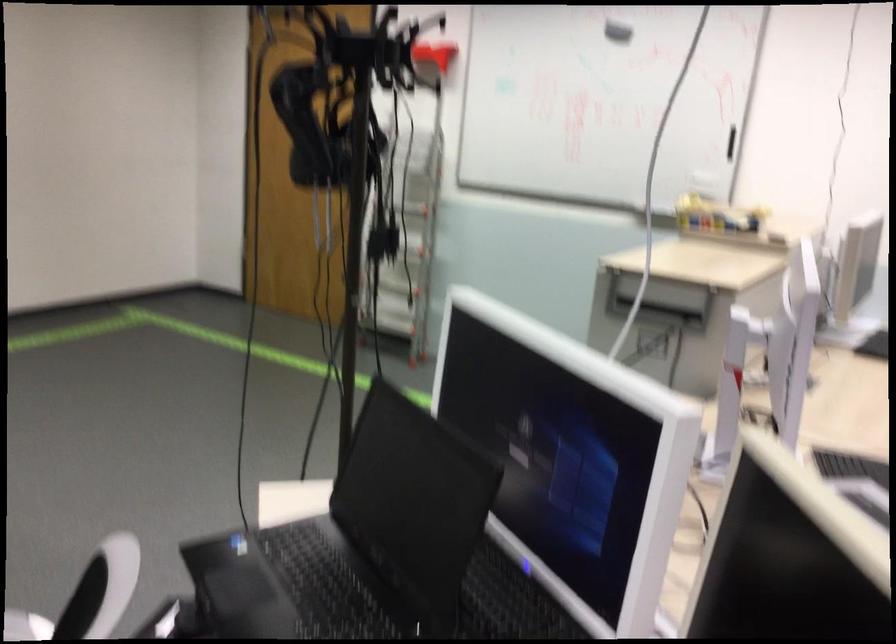
Where would you clos the black laptop lid? Please return your answer as a coordinate pair (x, y).

(412, 498)